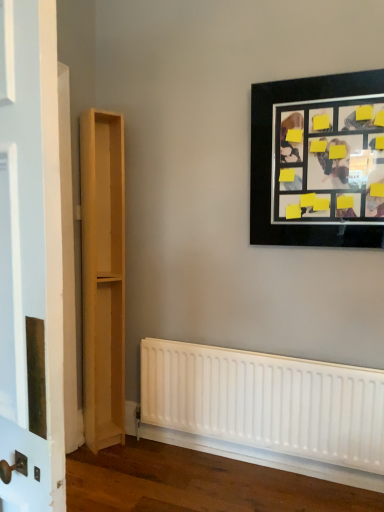
Question: Is white matte radiator at lower center in contact with black matte picture frame at upper right?

Choices:
 (A) no
 (B) yes

Answer: (A)

Question: From a real-world perspective, is white matte radiator at lower center physically above black matte picture frame at upper right?

Choices:
 (A) no
 (B) yes

Answer: (A)

Question: Is white matte radiator at lower center taller than black matte picture frame at upper right?

Choices:
 (A) yes
 (B) no

Answer: (B)

Question: From the image's perspective, does white matte radiator at lower center appear lower than black matte picture frame at upper right?

Choices:
 (A) yes
 (B) no

Answer: (A)

Question: Is white matte radiator at lower center facing away from black matte picture frame at upper right?

Choices:
 (A) no
 (B) yes

Answer: (A)

Question: Is white matte radiator at lower center positioned far away from black matte picture frame at upper right?

Choices:
 (A) yes
 (B) no

Answer: (A)

Question: Can we say light wood bookshelf at left lies outside white matte radiator at lower center?

Choices:
 (A) yes
 (B) no

Answer: (A)

Question: From a real-world perspective, is light wood bookshelf at left on top of white matte radiator at lower center?

Choices:
 (A) yes
 (B) no

Answer: (A)

Question: Is light wood bookshelf at left to the right of white matte radiator at lower center from the viewer's perspective?

Choices:
 (A) no
 (B) yes

Answer: (A)

Question: Does light wood bookshelf at left contain white matte radiator at lower center?

Choices:
 (A) no
 (B) yes

Answer: (A)

Question: Does light wood bookshelf at left have a greater width compared to white matte radiator at lower center?

Choices:
 (A) no
 (B) yes

Answer: (B)

Question: Is light wood bookshelf at left placed right next to white matte radiator at lower center?

Choices:
 (A) yes
 (B) no

Answer: (B)

Question: Is black matte picture frame at upper right behind light wood bookshelf at left?

Choices:
 (A) no
 (B) yes

Answer: (A)